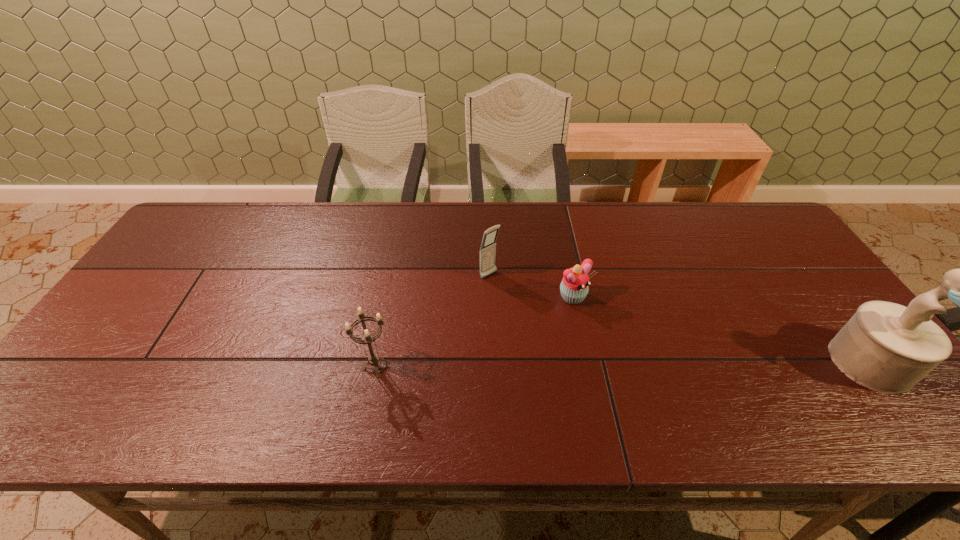
The height and width of the screenshot is (540, 960). I want to click on free space that is in between the tallest object and the cellular telephone, so click(680, 319).

Find the location of a particular element. This screenshot has height=540, width=960. unoccupied position between the figurine and the cellular telephone is located at coordinates (680, 319).

Identify the location of empty space between the leftmost object and the shortest object. The height and width of the screenshot is (540, 960). (475, 332).

The image size is (960, 540). Identify the location of vacant space in between the cellular telephone and the figurine. (680, 319).

Choose which object is the third nearest neighbor to the rightmost object. Please provide its 2D coordinates. Your answer should be formatted as a tuple, i.e. [(x, y)], where the tuple contains the x and y coordinates of a point satisfying the conditions above.

[(373, 359)]

Choose which object is the second nearest neighbor to the figurine. Please provide its 2D coordinates. Your answer should be formatted as a tuple, i.e. [(x, y)], where the tuple contains the x and y coordinates of a point satisfying the conditions above.

[(488, 246)]